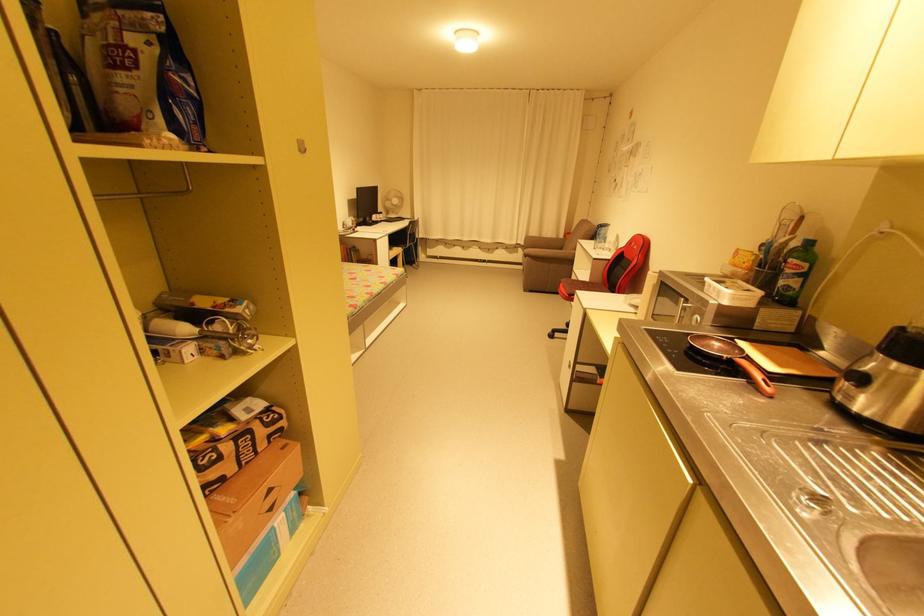
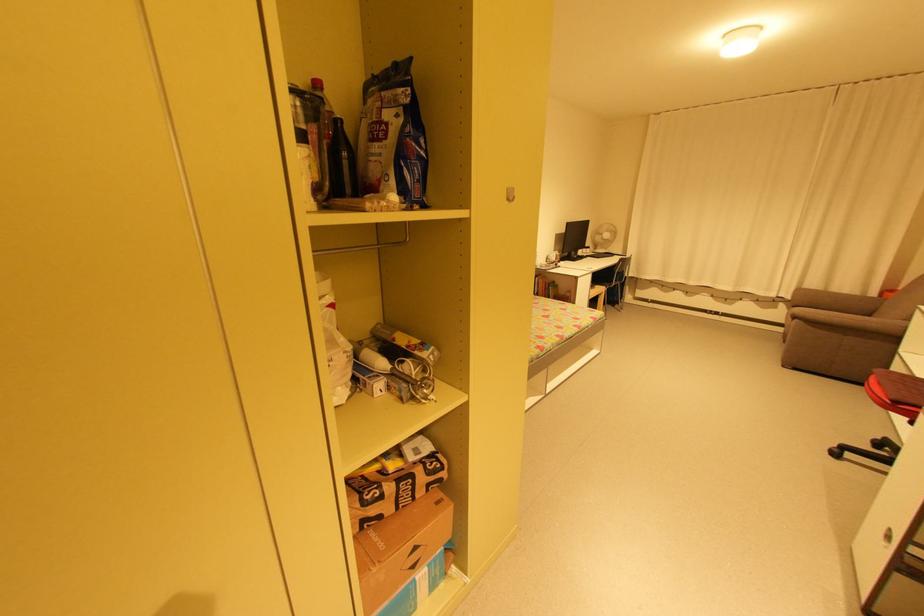
In the second image, find the point that corresponds to (x=385, y=215) in the first image.

(592, 249)